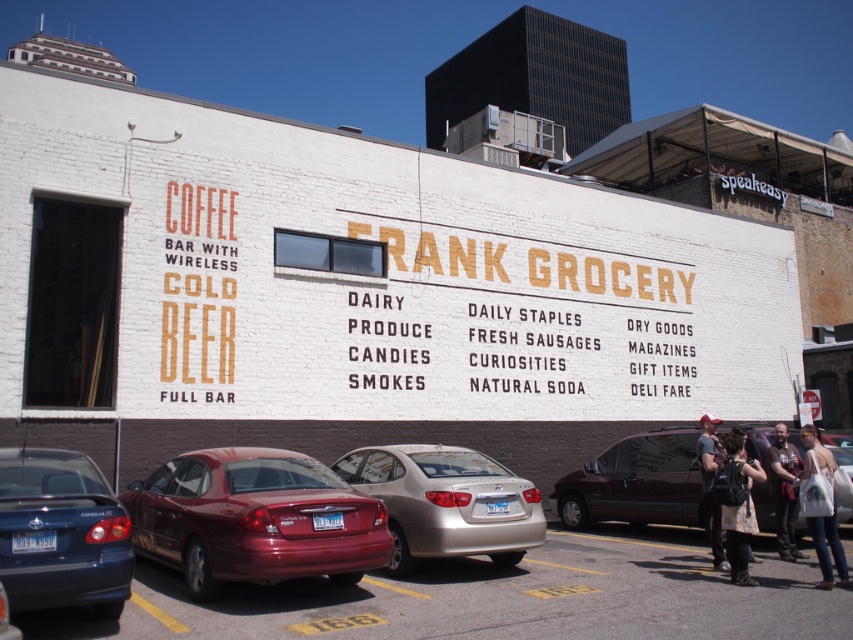
Who is more forward, (788,444) or (708,477)?

Point (708,477)

From the picture: Which of these two, dark brown leather jacket at lower right or dark gray t-shirt at lower right, stands taller?

With more height is dark gray t-shirt at lower right.

Locate an element on the screen. dark brown leather jacket at lower right is located at coordinates (784, 490).

Is metallic blue car at lower left to the left of dark brown leather jacket at lower right from the viewer's perspective?

Correct, you'll find metallic blue car at lower left to the left of dark brown leather jacket at lower right.

The width and height of the screenshot is (853, 640). Describe the element at coordinates (496, 596) in the screenshot. I see `metallic blue car at lower left` at that location.

What are the coordinates of `metallic blue car at lower left` in the screenshot? It's located at coord(496,596).

Does shiny red sedan at center come behind dark brown leather jacket at lower right?

No.

Is shiny red sedan at center thinner than dark brown leather jacket at lower right?

No, shiny red sedan at center is not thinner than dark brown leather jacket at lower right.

Who is more forward, (x=363, y=552) or (x=785, y=486)?

Point (x=363, y=552) is in front.

Where is `shiny red sedan at center`? The image size is (853, 640). shiny red sedan at center is located at coordinates (254, 518).